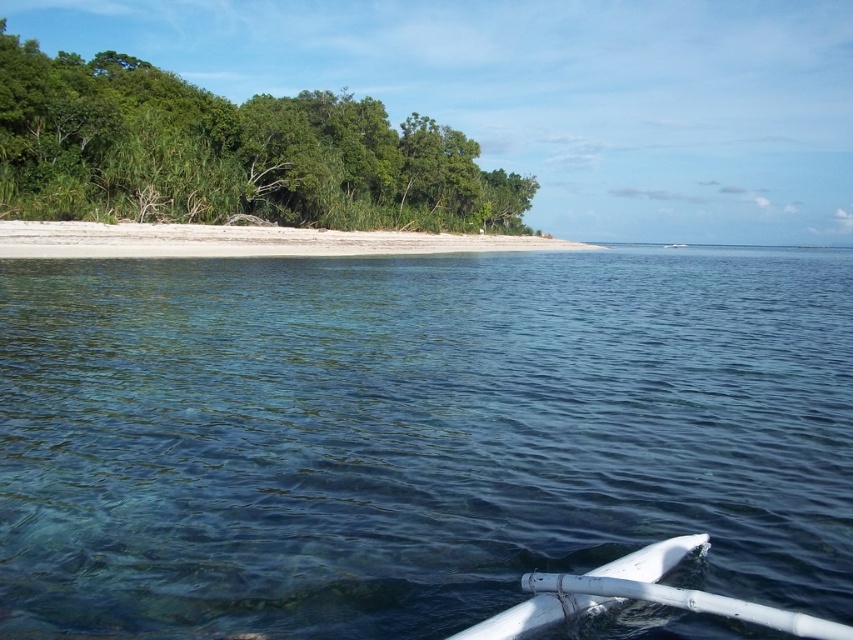
You are standing on the boat and looking at the clear blue water at center and the green leafy trees at left. Which object appears narrower from your perspective?

The clear blue water at center appears narrower than the green leafy trees at left because it is thinner.

You are standing on the white sand beach at center and want to walk to the green leafy trees at left. Which direction should you walk to reach them?

You should walk to the left to reach the green leafy trees at left because they are positioned to the left side of the white sand beach at center.